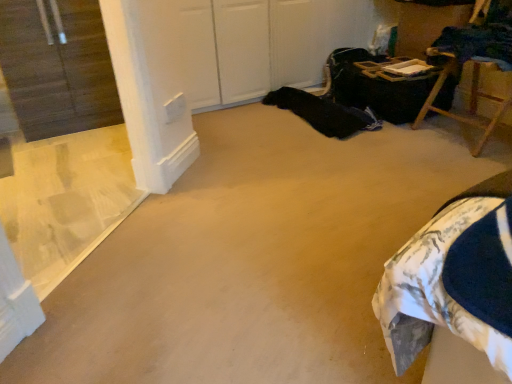
Question: Is wooden folding chair at upper right at the left side of transparent plastic window at left?

Choices:
 (A) no
 (B) yes

Answer: (A)

Question: From the image's perspective, is wooden folding chair at upper right located beneath transparent plastic window at left?

Choices:
 (A) no
 (B) yes

Answer: (A)

Question: Is wooden folding chair at upper right facing towards transparent plastic window at left?

Choices:
 (A) yes
 (B) no

Answer: (A)

Question: Can you confirm if wooden folding chair at upper right is shorter than transparent plastic window at left?

Choices:
 (A) yes
 (B) no

Answer: (A)

Question: From a real-world perspective, is wooden folding chair at upper right below transparent plastic window at left?

Choices:
 (A) yes
 (B) no

Answer: (A)

Question: Does wooden folding chair at upper right have a larger size compared to transparent plastic window at left?

Choices:
 (A) no
 (B) yes

Answer: (B)

Question: From a real-world perspective, does transparent plastic window at left stand above wooden folding chair at upper right?

Choices:
 (A) yes
 (B) no

Answer: (A)

Question: Considering the relative sizes of transparent plastic window at left and wooden folding chair at upper right in the image provided, is transparent plastic window at left thinner than wooden folding chair at upper right?

Choices:
 (A) no
 (B) yes

Answer: (B)

Question: Does transparent plastic window at left have a lesser height compared to wooden folding chair at upper right?

Choices:
 (A) yes
 (B) no

Answer: (B)

Question: Is transparent plastic window at left located outside wooden folding chair at upper right?

Choices:
 (A) yes
 (B) no

Answer: (A)

Question: Can you confirm if transparent plastic window at left is taller than wooden folding chair at upper right?

Choices:
 (A) yes
 (B) no

Answer: (A)

Question: From the image's perspective, is transparent plastic window at left under wooden folding chair at upper right?

Choices:
 (A) no
 (B) yes

Answer: (B)

Question: Based on their sizes in the image, would you say transparent plastic window at left is bigger or smaller than wooden folding chair at upper right?

Choices:
 (A) small
 (B) big

Answer: (A)